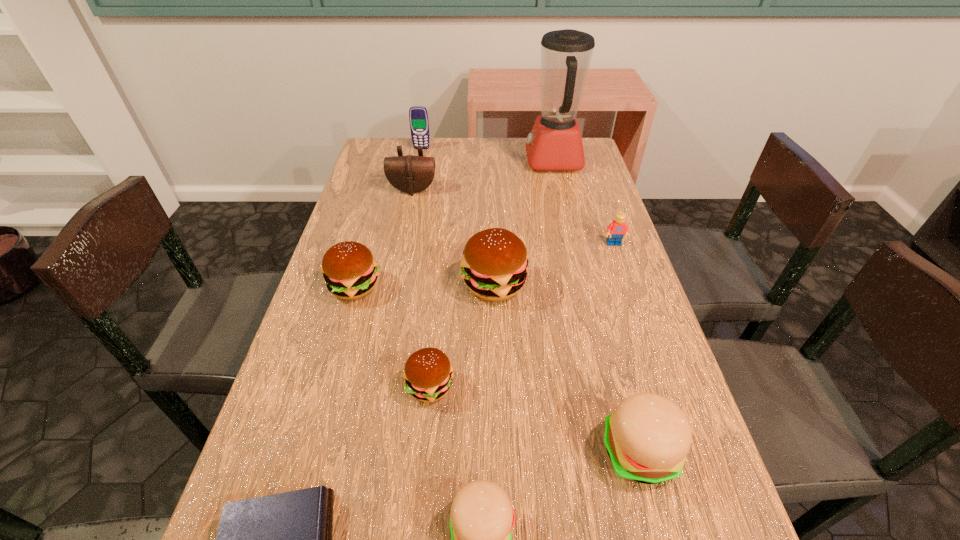
I want to click on free region that satisfies the following two spatial constraints: 1. with the flap open on the third nearest object; 2. on the left side of the pouch, so click(x=361, y=451).

You are a GUI agent. You are given a task and a screenshot of the screen. Output one action in this format:
    pyautogui.click(x=<x>, y=<y>)
    Task: Click on the vacant space that satisfies the following two spatial constraints: 1. on the front-facing side of the cellular telephone; 2. on the right side of the second brown hamburger from left to right
    The image size is (960, 540).
    Given the screenshot: What is the action you would take?
    pyautogui.click(x=375, y=386)